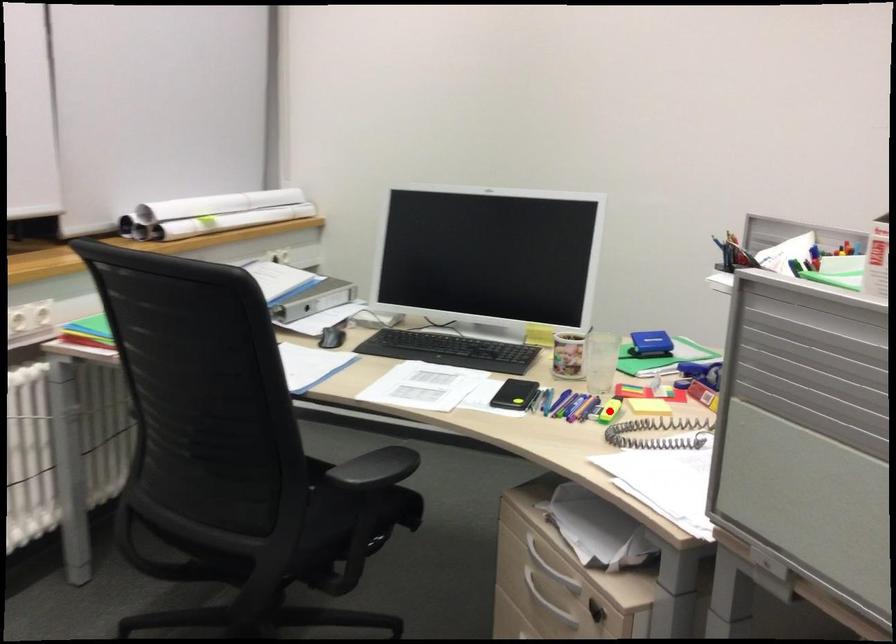
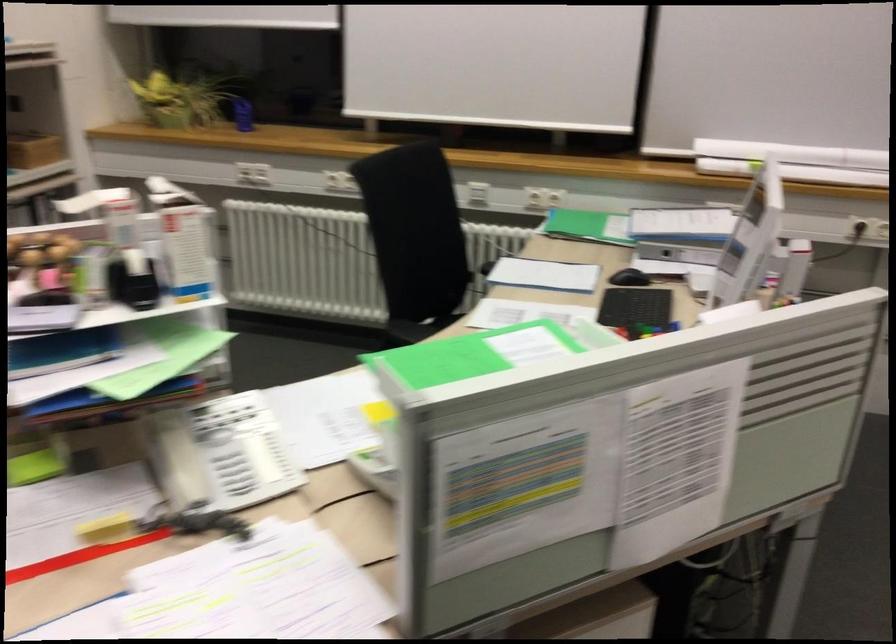
Question: I am providing you with two images of the same scene from different viewpoints. A red point is marked on the first image. Can you still see the location of the red point in image 2?

Choices:
 (A) Yes
 (B) No

Answer: (B)